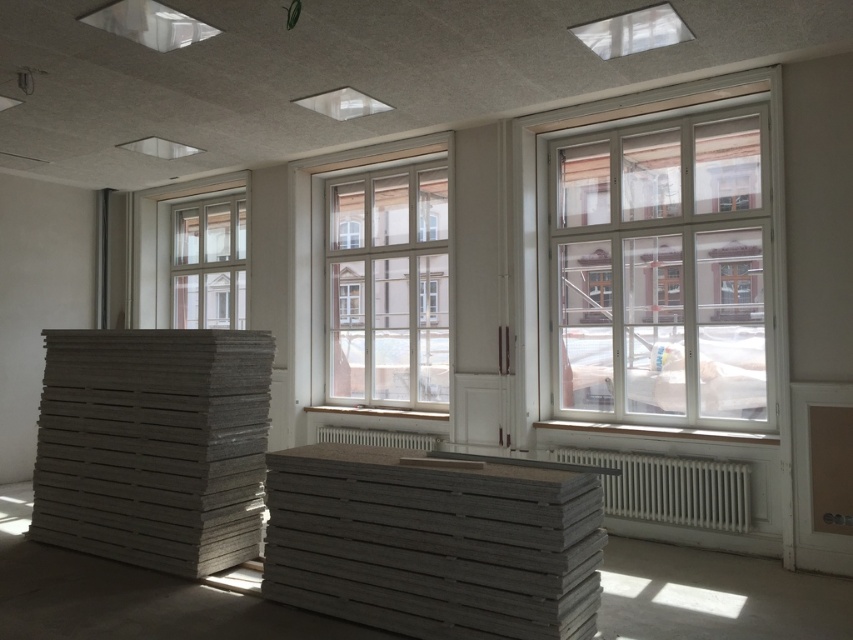
You are standing in the construction area and want to move from the first point to the second point. Which direction should you move to go from point (172, 284) to point (399, 461)?

To move from point (172, 284) to point (399, 461), you should move forward since point (172, 284) is behind point (399, 461).

You are an interior designer looking at the room layout. You need to place a new piece of furniture between the clear glass window at upper left and the gray matte palette at center. Based on their positions, which object should be placed closer to the left side?

The clear glass window at upper left should be placed closer to the left side since it is positioned to the left of the gray matte palette at center.

You are a contractor assessing the materials in the room. You need to determine which object is narrower between the white glass window at right and the gray matte lumber at left. Which one is it?

The white glass window at right is thinner than the gray matte lumber at left, so the white glass window at right is narrower.